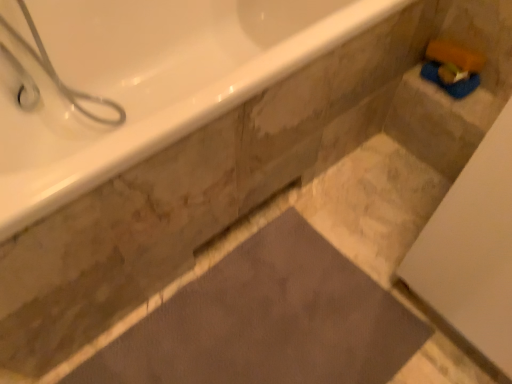
This screenshot has height=384, width=512. What do you see at coordinates (267, 321) in the screenshot?
I see `dark gray matte bath mat at center` at bounding box center [267, 321].

What is the approximate width of dark gray matte bath mat at center?

The width of dark gray matte bath mat at center is 52.36 centimeters.

Describe the element at coordinates (67, 86) in the screenshot. I see `white glossy shower at upper left` at that location.

The width and height of the screenshot is (512, 384). I want to click on dark gray matte bath mat at center, so click(267, 321).

Is white glossy shower at upper left in contact with dark gray matte bath mat at center?

No, white glossy shower at upper left is not beside dark gray matte bath mat at center.

From the image's perspective, between white glossy shower at upper left and dark gray matte bath mat at center, which one is located above?

From the image's view, white glossy shower at upper left is above.

Considering the relative sizes of white glossy shower at upper left and dark gray matte bath mat at center in the image provided, is white glossy shower at upper left thinner than dark gray matte bath mat at center?

Indeed, white glossy shower at upper left has a lesser width compared to dark gray matte bath mat at center.

How far apart are white glossy shower at upper left and dark gray matte bath mat at center?

29.03 inches.

From a real-world perspective, is dark gray matte bath mat at center under white glossy bathtub at upper left?

Indeed, from a real-world perspective, dark gray matte bath mat at center is positioned beneath white glossy bathtub at upper left.

Is dark gray matte bath mat at center wider or thinner than white glossy bathtub at upper left?

dark gray matte bath mat at center is thinner than white glossy bathtub at upper left.

Considering their positions, is dark gray matte bath mat at center located in front of or behind white glossy bathtub at upper left?

dark gray matte bath mat at center is behind white glossy bathtub at upper left.

Is the depth of white glossy shower at upper left less than that of white glossy bathtub at upper left?

No, it is behind white glossy bathtub at upper left.

Which of these two, white glossy shower at upper left or white glossy bathtub at upper left, stands taller?

With more height is white glossy bathtub at upper left.

Is white glossy shower at upper left located outside white glossy bathtub at upper left?

Answer: No, white glossy shower at upper left is not entirely external to white glossy bathtub at upper left.

From the image's perspective, is white glossy shower at upper left beneath white glossy bathtub at upper left?

No, from the image's perspective, white glossy shower at upper left is not below white glossy bathtub at upper left.

Is white glossy bathtub at upper left oriented away from dark gray matte bath mat at center?

white glossy bathtub at upper left is not turned away from dark gray matte bath mat at center.

Looking at their sizes, would you say white glossy bathtub at upper left is wider or thinner than dark gray matte bath mat at center?

Clearly, white glossy bathtub at upper left has more width compared to dark gray matte bath mat at center.

From a real-world perspective, relative to dark gray matte bath mat at center, is white glossy bathtub at upper left vertically above or below?

white glossy bathtub at upper left is situated higher than dark gray matte bath mat at center in the real world.

From the image's perspective, which is above, white glossy bathtub at upper left or dark gray matte bath mat at center?

white glossy bathtub at upper left is shown above in the image.

Is white glossy bathtub at upper left not inside white glossy shower at upper left?

white glossy bathtub at upper left lies outside white glossy shower at upper left's area.

Considering the sizes of white glossy bathtub at upper left and white glossy shower at upper left in the image, is white glossy bathtub at upper left bigger or smaller than white glossy shower at upper left?

white glossy bathtub at upper left is bigger than white glossy shower at upper left.

Who is shorter, white glossy bathtub at upper left or white glossy shower at upper left?

white glossy shower at upper left.

Considering the relative sizes of white glossy bathtub at upper left and white glossy shower at upper left in the image provided, is white glossy bathtub at upper left thinner than white glossy shower at upper left?

Incorrect, the width of white glossy bathtub at upper left is not less than that of white glossy shower at upper left.

In the scene shown: Which of these two, dark gray matte bath mat at center or white glossy shower at upper left, is smaller?

dark gray matte bath mat at center is smaller.

Does point (234, 374) lie in front of point (50, 76)?

Yes.

Does dark gray matte bath mat at center come behind white glossy shower at upper left?

That is False.

Is white glossy shower at upper left surrounded by dark gray matte bath mat at center?

That's incorrect, white glossy shower at upper left is not inside dark gray matte bath mat at center.

The height and width of the screenshot is (384, 512). I want to click on bath mat below the white glossy shower at upper left (from a real-world perspective), so click(x=267, y=321).

What are the coordinates of `bath mat that appears below the white glossy bathtub at upper left (from the image's perspective)` in the screenshot? It's located at (267, 321).

Which object lies nearer to the anchor point white glossy bathtub at upper left, dark gray matte bath mat at center or white glossy shower at upper left?

white glossy shower at upper left.

From the picture: Which object lies nearer to the anchor point white glossy bathtub at upper left, white glossy shower at upper left or dark gray matte bath mat at center?

The object closer to white glossy bathtub at upper left is white glossy shower at upper left.

Which object lies nearer to the anchor point white glossy shower at upper left, dark gray matte bath mat at center or white glossy bathtub at upper left?

Among the two, white glossy bathtub at upper left is located nearer to white glossy shower at upper left.

Which object lies further to the anchor point dark gray matte bath mat at center, white glossy shower at upper left or white glossy bathtub at upper left?

white glossy shower at upper left is further to dark gray matte bath mat at center.

Estimate the real-world distances between objects in this image. Which object is further from dark gray matte bath mat at center, white glossy bathtub at upper left or white glossy shower at upper left?

white glossy shower at upper left lies further to dark gray matte bath mat at center than the other object.

Estimate the real-world distances between objects in this image. Which object is further from white glossy shower at upper left, white glossy bathtub at upper left or dark gray matte bath mat at center?

dark gray matte bath mat at center.

Where is `bathtub between white glossy shower at upper left and dark gray matte bath mat at center in the vertical direction`? bathtub between white glossy shower at upper left and dark gray matte bath mat at center in the vertical direction is located at coordinates (145, 80).